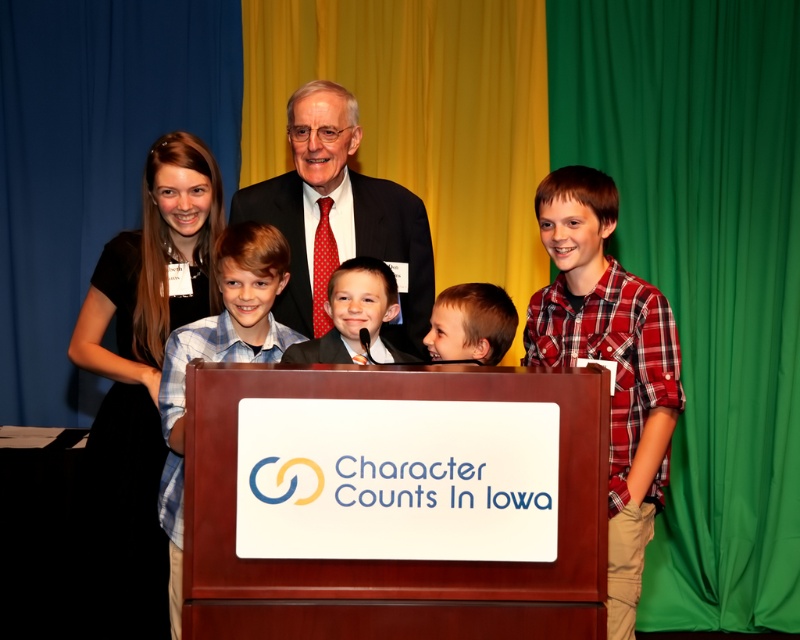
Question: Which point is farther from the camera taking this photo?

Choices:
 (A) (566, 273)
 (B) (612, 188)
 (C) (488, 323)
 (D) (206, 320)

Answer: (A)

Question: Considering the relative positions of blue plaid shirt at center and blonde hair at center in the image provided, where is blue plaid shirt at center located with respect to blonde hair at center?

Choices:
 (A) left
 (B) right

Answer: (A)

Question: Can you confirm if matte black suit at center is bigger than blue plaid shirt at center?

Choices:
 (A) yes
 (B) no

Answer: (B)

Question: Among these points, which one is farthest from the camera?

Choices:
 (A) (233, 205)
 (B) (594, 272)

Answer: (A)

Question: Which of the following is the farthest from the observer?

Choices:
 (A) red plaid shirt at right
 (B) smooth black suit at center
 (C) matte black suit at center

Answer: (C)

Question: Where is red plaid shirt at right located in relation to blue plaid shirt at center in the image?

Choices:
 (A) right
 (B) left

Answer: (A)